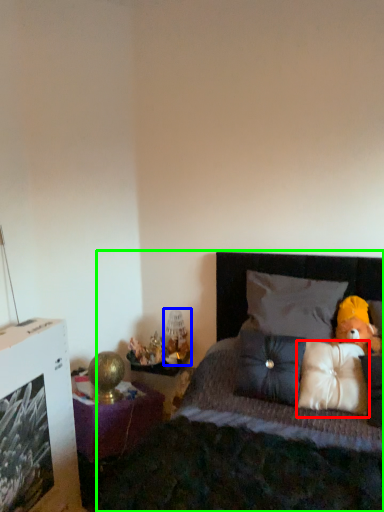
Question: Which object is positioned closest to pillow (highlighted by a red box)? Select from table lamp (highlighted by a blue box) and bed (highlighted by a green box).

Choices:
 (A) table lamp
 (B) bed

Answer: (B)